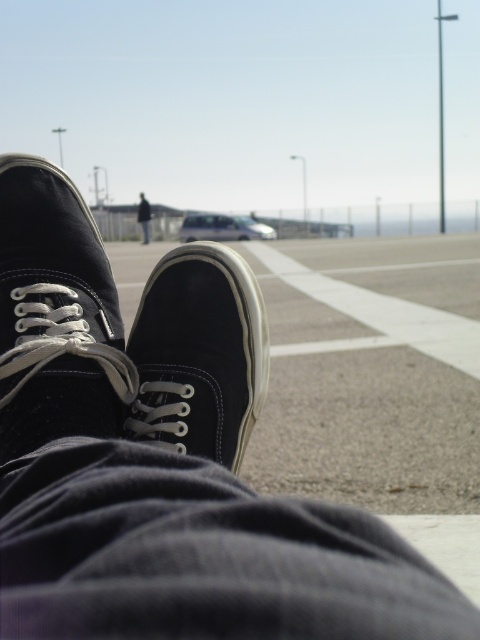
You are designing a shoe display stand that must accommodate both the matte black shoe at lower left and the dark blue jeans at center. Since the stand has a fixed width, which item requires more space horizontally?

The dark blue jeans at center requires more horizontal space because the matte black shoe at lower left is narrower than the dark blue jeans at center according to their widths.

You are standing on a paved area with light and dark sections and need to place a matte black shoe at center exactly 32.06 inches away from you. Given the paved area has light colored concrete squares and darker gravel sections, which material will the shoe be placed on?

The matte black shoe at center is 32.06 inches from the viewer, so it will be placed on the light colored concrete squares since the paved area has light colored concrete squares and darker gravel sections.

You are a photographer trying to capture a close shot of the matte black shoe at center and dark blue jeans at center. Since the camera can only focus on one object at a time, which object should you prioritize to ensure it takes up more of the frame?

The dark blue jeans at center should be prioritized because the matte black shoe at center occupies less space, meaning the jeans will take up more of the frame and should be the focus.